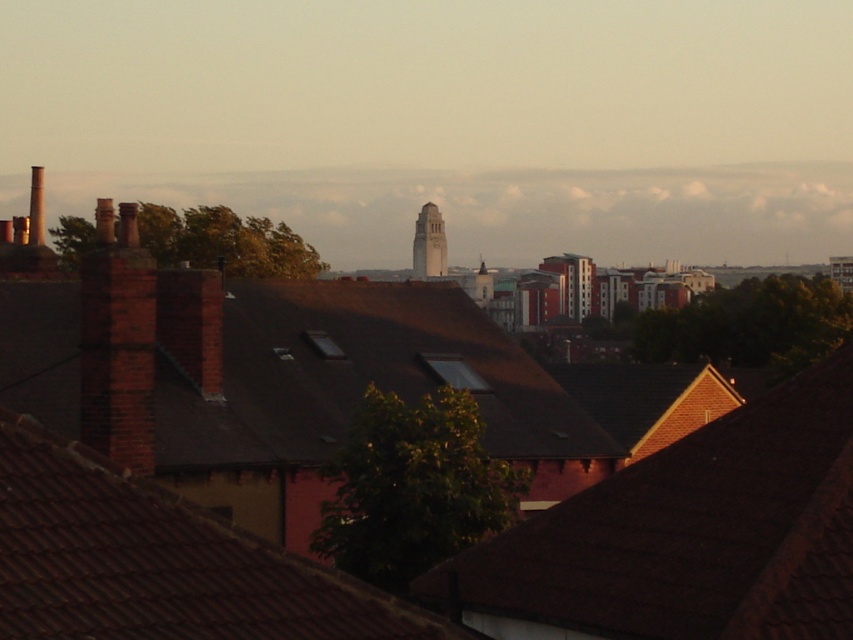
Between point (341, 636) and point (146, 269), which one is positioned behind?

The point (146, 269) is more distant.

Is brown tile roof at center positioned behind brick chimney at left?

No, brown tile roof at center is in front of brick chimney at left.

Where is `brown tile roof at center`? This screenshot has height=640, width=853. brown tile roof at center is located at coordinates (160, 563).

Can you confirm if brick chimney at left is wider than smooth concrete clock tower at center?

No, brick chimney at left is not wider than smooth concrete clock tower at center.

Which is more to the left, brick chimney at left or smooth concrete clock tower at center?

brick chimney at left

I want to click on brick chimney at left, so click(x=119, y=342).

Between point (654, 588) and point (434, 225), which one is positioned in front?

Point (654, 588) is more forward.

Can you confirm if brown tile roof at lower right is taller than smooth concrete clock tower at center?

In fact, brown tile roof at lower right may be shorter than smooth concrete clock tower at center.

Is point (848, 385) more distant than point (425, 212)?

No, it is not.

Where is `brown tile roof at lower right`? The width and height of the screenshot is (853, 640). brown tile roof at lower right is located at coordinates (686, 536).